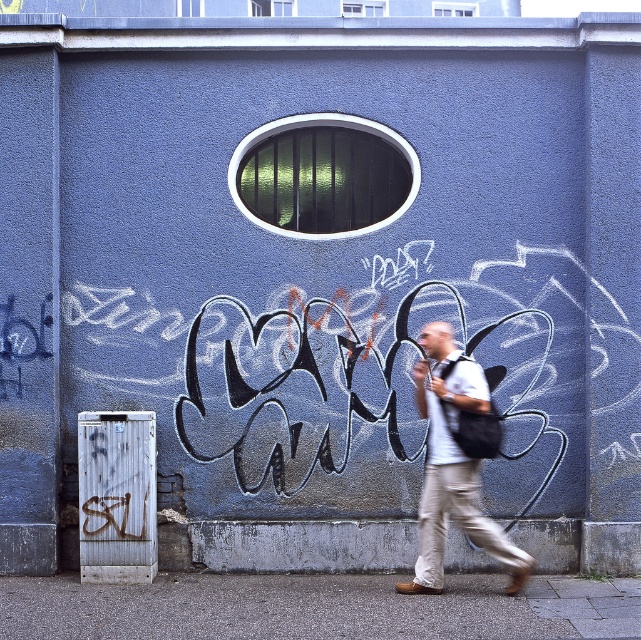
Question: Is gray concrete pavement at lower center above white cotton shirt at center?

Choices:
 (A) yes
 (B) no

Answer: (B)

Question: Which of the following is the farthest from the observer?

Choices:
 (A) (378, 593)
 (B) (470, 419)

Answer: (A)

Question: Which point appears closest to the camera in this image?

Choices:
 (A) (335, 636)
 (B) (488, 531)

Answer: (A)

Question: Considering the relative positions of gray concrete pavement at lower center and white cotton shirt at center in the image provided, where is gray concrete pavement at lower center located with respect to white cotton shirt at center?

Choices:
 (A) right
 (B) left

Answer: (B)

Question: Can you confirm if gray concrete pavement at lower center is positioned to the right of white cotton shirt at center?

Choices:
 (A) yes
 (B) no

Answer: (B)